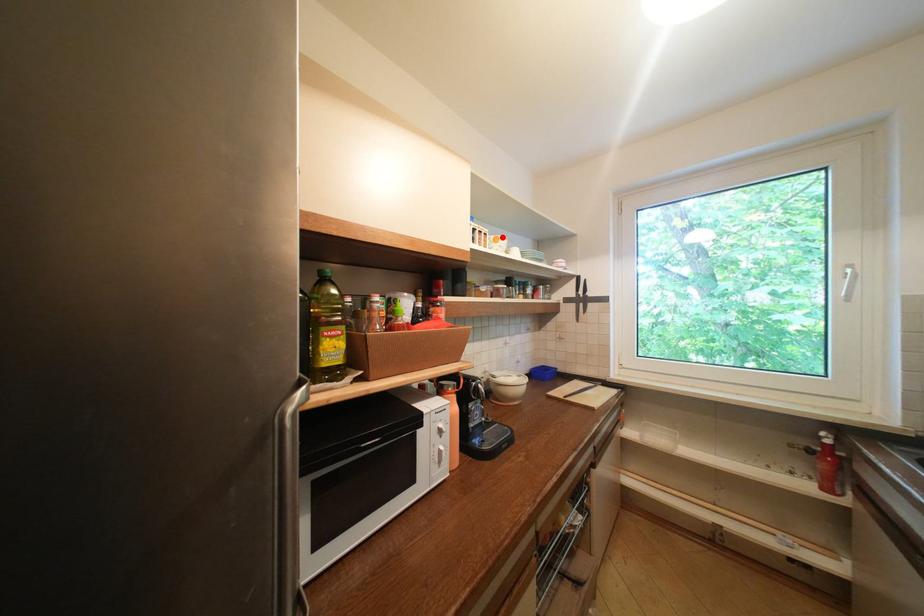
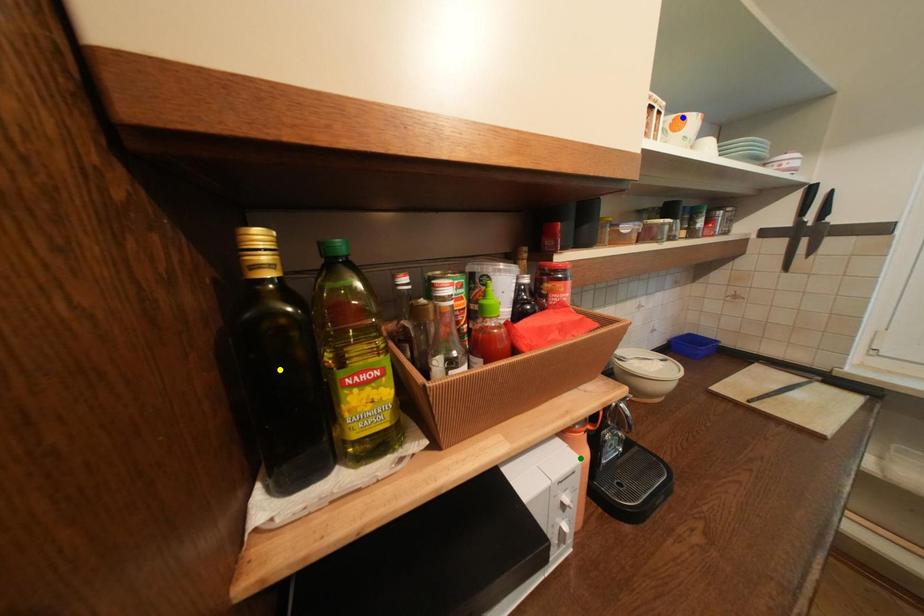
Question: I am providing you with two images of the same scene from different viewpoints. A red point is marked on the first image. You are given multiple points on the second image. Which mark in image 2 goes with the point in image 1?

Choices:
 (A) green point
 (B) yellow point
 (C) blue point

Answer: (C)